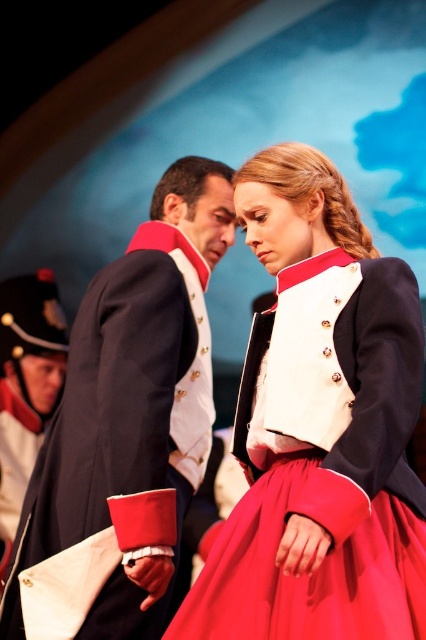
You are a costume designer measuring the distance between the matte black jacket at center and the navy blue uniform at center for a stage play. The minimum required distance between costumes for proper visibility is 20 inches. Can both costumes be placed at their current positions without violating this requirement?

The matte black jacket at center and navy blue uniform at center are 22.18 inches apart, which exceeds the minimum required distance of 20 inches. Therefore, both costumes can be placed at their current positions without violating the visibility requirement.

You are a costume designer observing the theatrical scene. You need to determine which costume is shorter between the matte black jacket at center and the navy blue uniform at center. Which one is shorter?

The matte black jacket at center is shorter than the navy blue uniform at center.